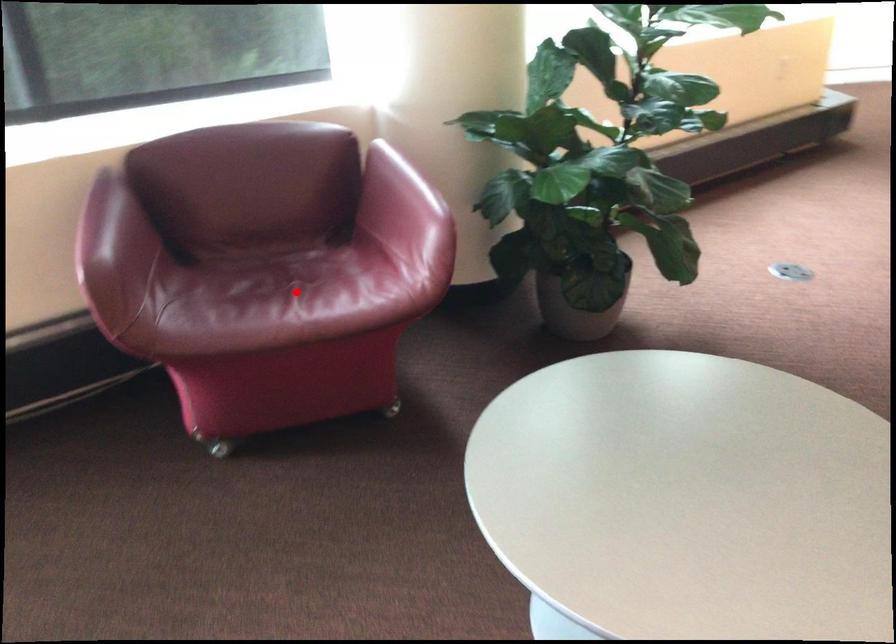
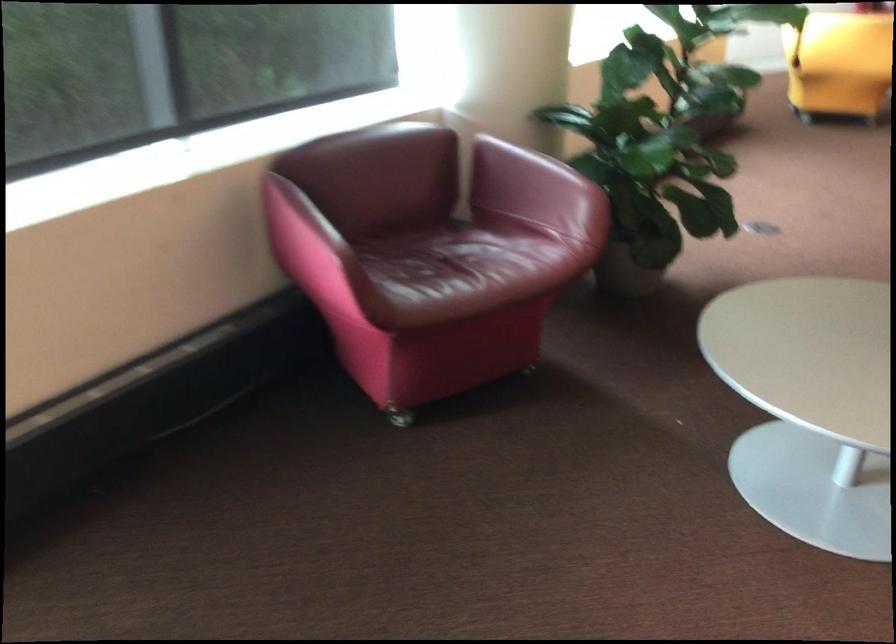
Question: A red point is marked in image1. In image2, is the corresponding 3D point closer to the camera or farther? Reply with the corresponding letter.

Choices:
 (A) The corresponding 3D point is closer.
 (B) The corresponding 3D point is farther.

Answer: (B)